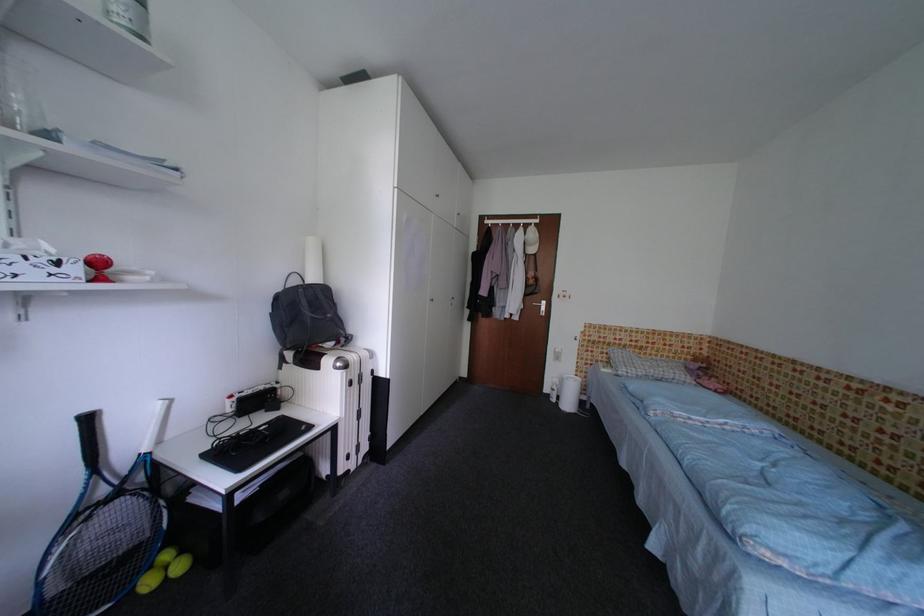
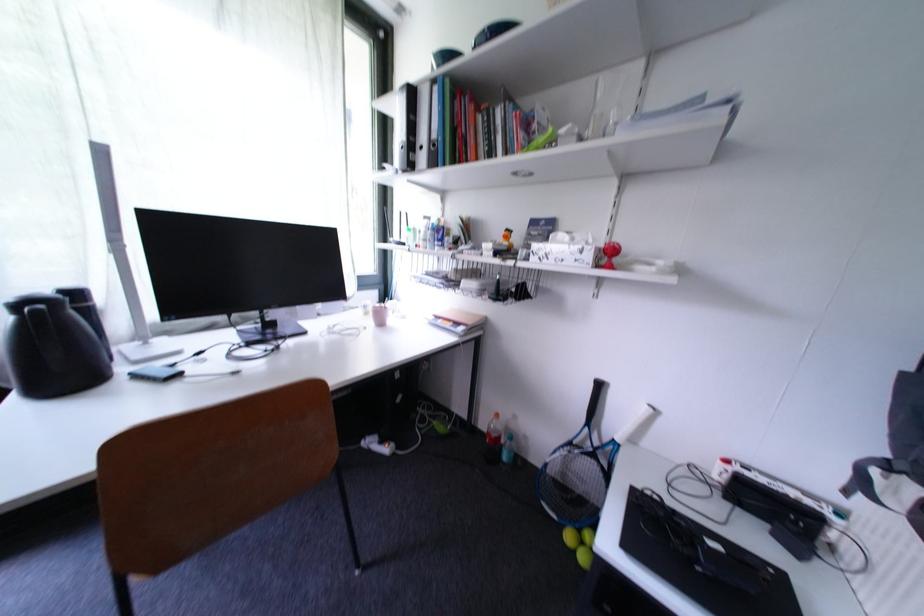
The point at (175, 570) is marked in the first image. Where is the corresponding point in the second image?

(590, 546)